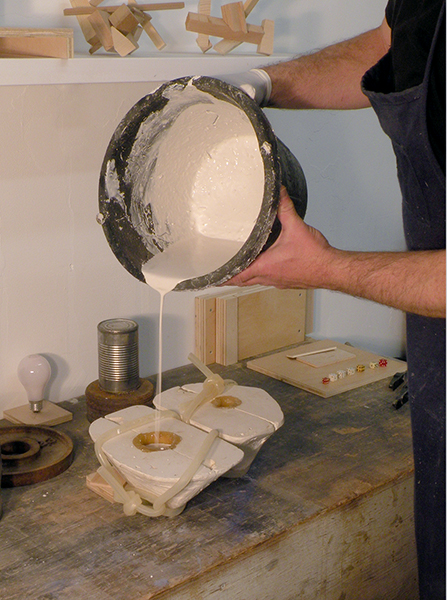
This screenshot has height=600, width=447. What are the coordinates of `wood block table` in the screenshot? It's located at (295, 467).